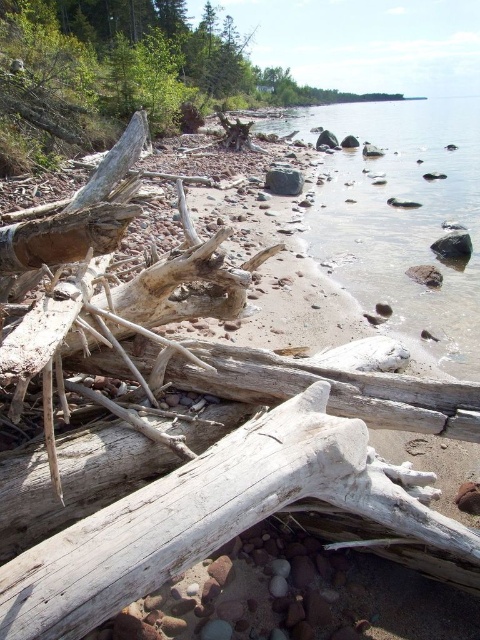
Question: Does clear glass water at center have a greater width compared to black smooth rock at center?

Choices:
 (A) yes
 (B) no

Answer: (A)

Question: Which point appears closest to the camera in this image?

Choices:
 (A) [x=300, y=179]
 (B) [x=372, y=122]

Answer: (A)

Question: Among these objects, which one is farthest from the camera?

Choices:
 (A) clear glass water at center
 (B) black smooth rock at center

Answer: (B)

Question: Does clear glass water at center lie in front of black smooth rock at center?

Choices:
 (A) no
 (B) yes

Answer: (B)

Question: Which of the following is the closest to the observer?

Choices:
 (A) (475, 204)
 (B) (284, 172)

Answer: (A)

Question: Can you confirm if clear glass water at center is positioned to the left of black smooth rock at center?

Choices:
 (A) no
 (B) yes

Answer: (A)